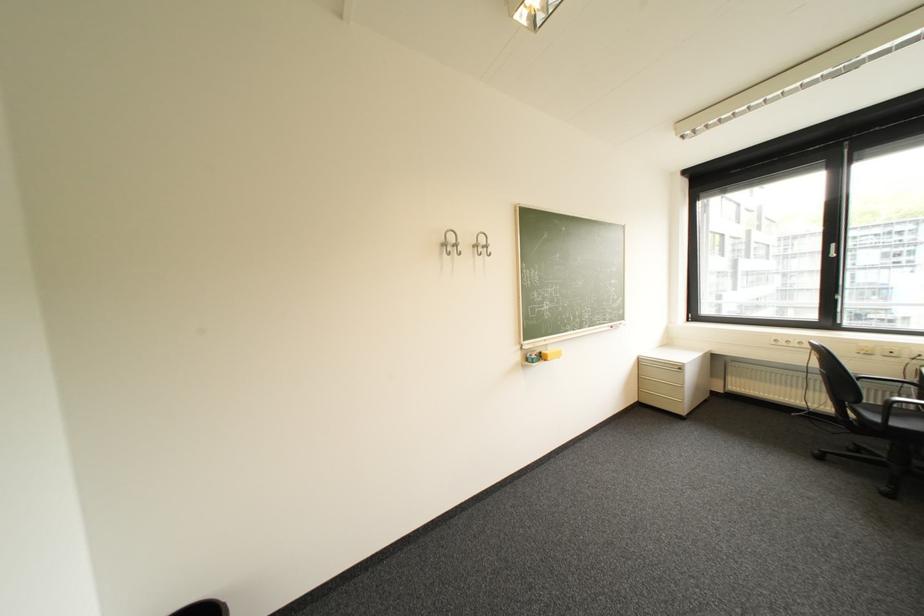
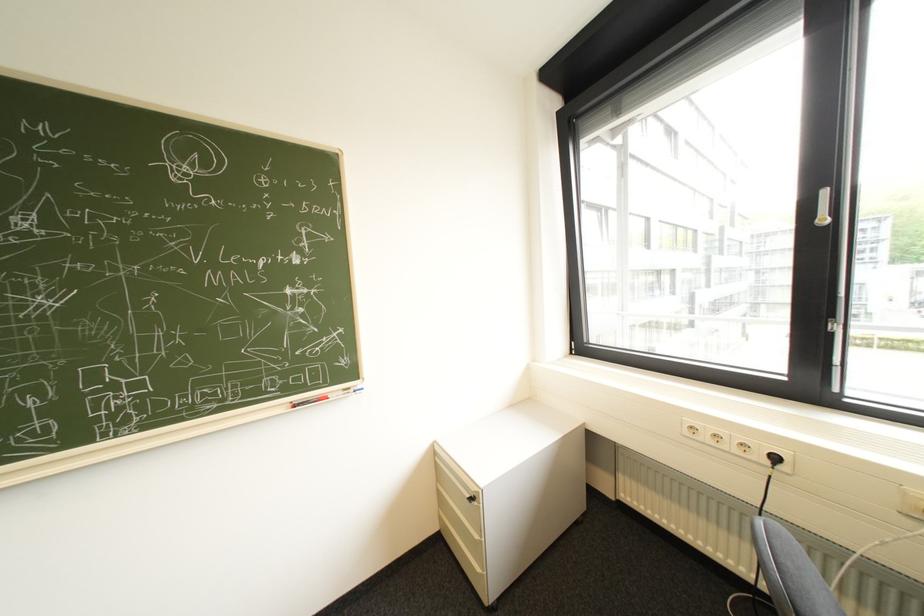
Find the pixel in the second image that matches (844,245) in the first image.

(834, 193)